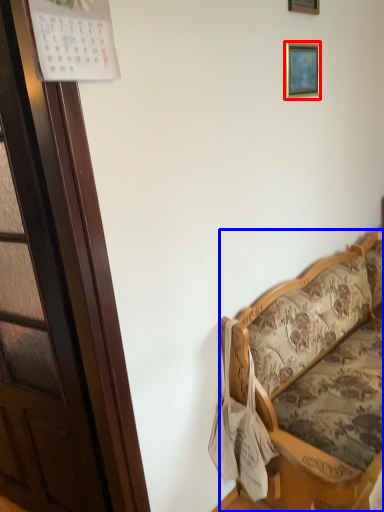
Question: Which point is further to the camera, picture frame (highlighted by a red box) or studio couch (highlighted by a blue box)?

Choices:
 (A) picture frame
 (B) studio couch

Answer: (A)